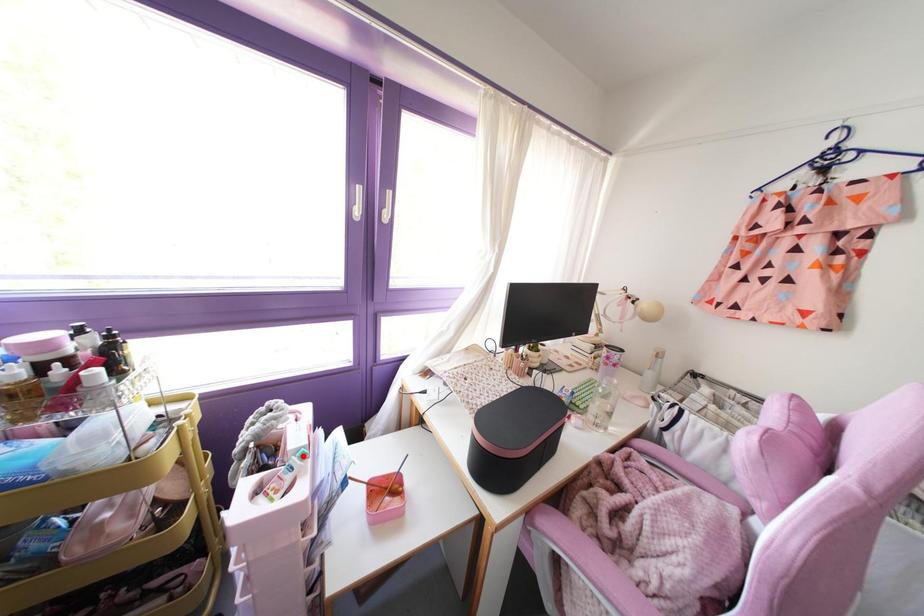
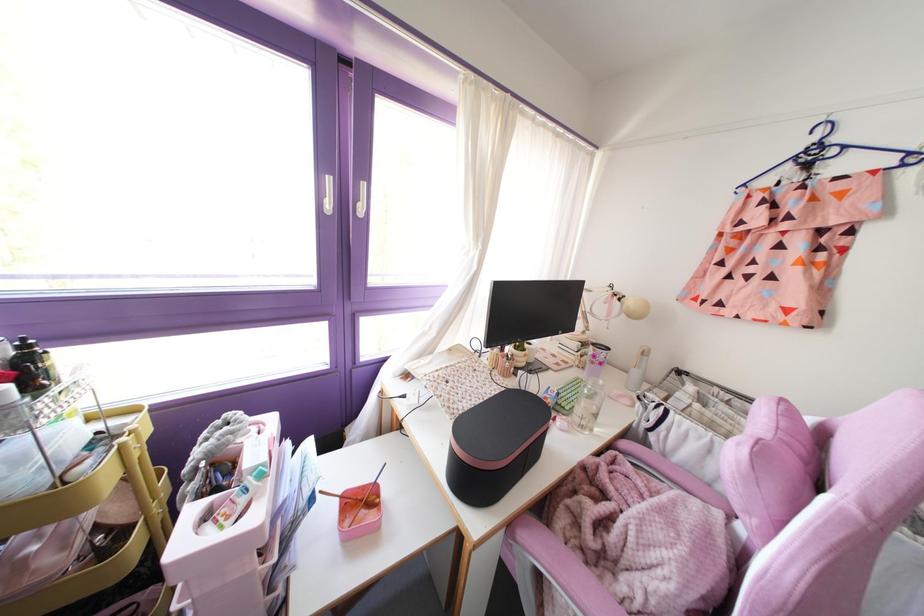
Question: A red point is marked in image1. In image2, is the corresponding 3D point closer to the camera or farther? Reply with the corresponding letter.

Choices:
 (A) The corresponding 3D point is closer.
 (B) The corresponding 3D point is farther.

Answer: (B)